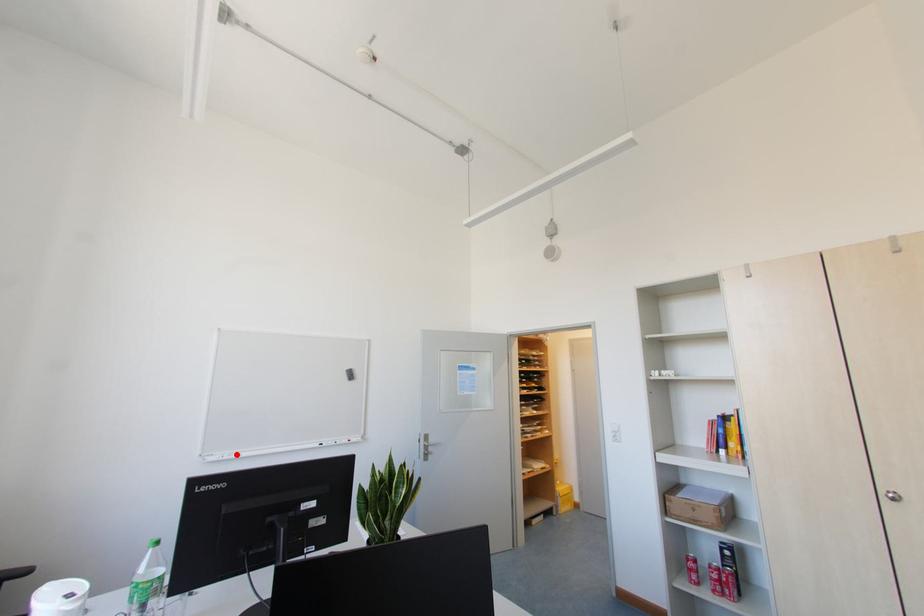
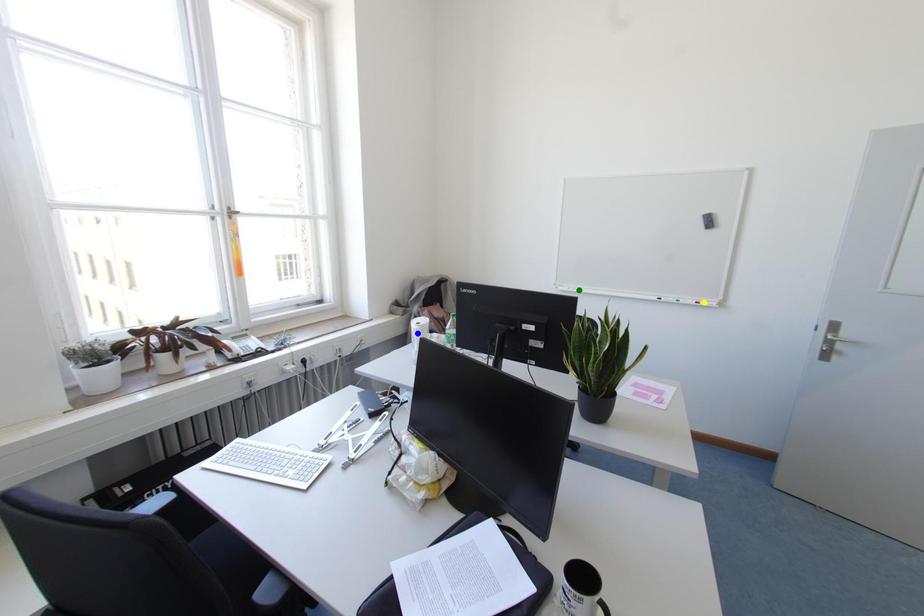
Question: I am providing you with two images of the same scene from different viewpoints. A red point is marked on the first image. You are given multiple points on the second image. Which point in image 2 is actually the same real-world point as the red point in image 1?

Choices:
 (A) blue point
 (B) green point
 (C) yellow point

Answer: (B)